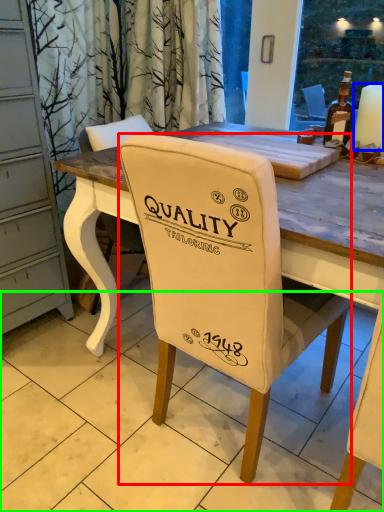
Question: Considering the real-world distances, which object is closest to chair (highlighted by a red box)? candle (highlighted by a blue box) or tile (highlighted by a green box).

Choices:
 (A) candle
 (B) tile

Answer: (B)